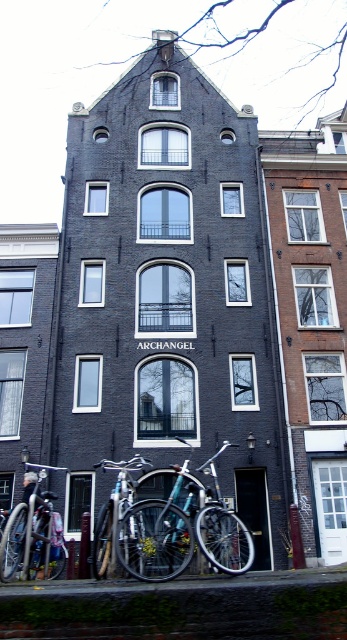
Question: Which point is closer to the camera?

Choices:
 (A) (31, 573)
 (B) (188, 481)
 (C) (132, 532)

Answer: (C)

Question: Is shiny metallic bicycle at lower left to the right of shiny metallic bicycle at lower center from the viewer's perspective?

Choices:
 (A) yes
 (B) no

Answer: (B)

Question: Does shiny metallic bicycle at lower left appear on the left side of shiny metallic bicycle at lower center?

Choices:
 (A) yes
 (B) no

Answer: (A)

Question: Which object is positioned closest to the shiny metallic bicycle at lower left?

Choices:
 (A) shiny metallic bicycle at lower center
 (B) shiny metallic bicycle at center

Answer: (A)

Question: Does shiny metallic bicycle at center have a lesser width compared to shiny metallic bicycle at lower left?

Choices:
 (A) yes
 (B) no

Answer: (B)

Question: Which of the following is the closest to the observer?

Choices:
 (A) shiny metallic bicycle at lower left
 (B) shiny metallic bicycle at center
 (C) shiny metallic bicycle at lower center

Answer: (B)